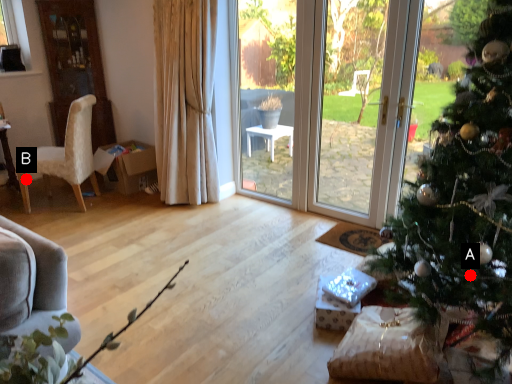
Question: Two points are circled on the image, labeled by A and B beside each circle. Which point is closer to the camera?

Choices:
 (A) A is closer
 (B) B is closer

Answer: (A)